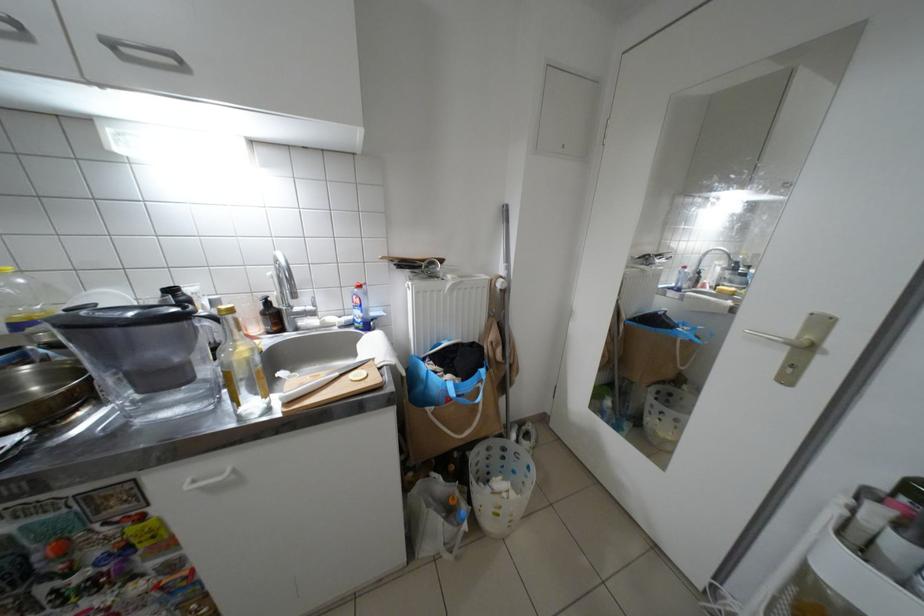
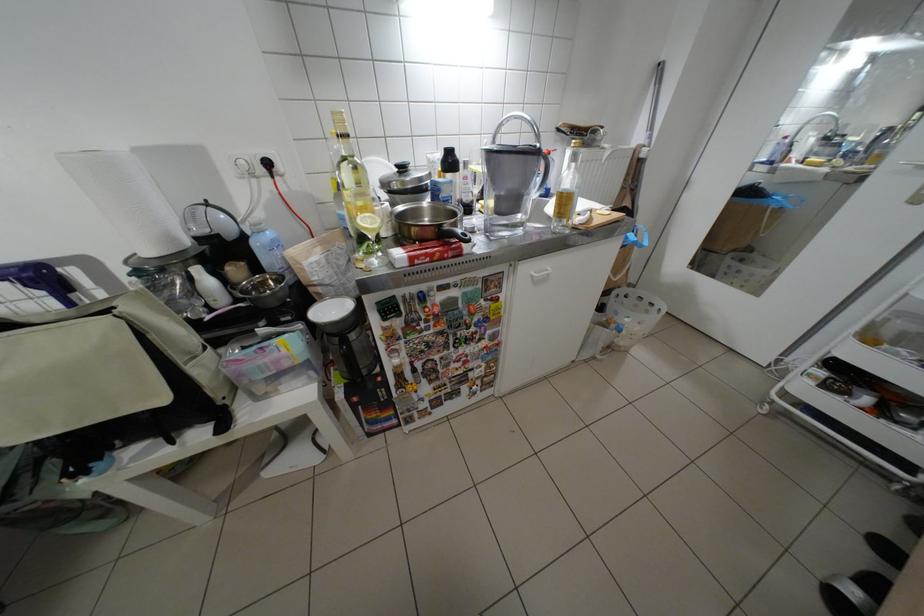
Which direction would the cameraman need to move to produce the second image?

The movement direction of the cameraman is left, backward.